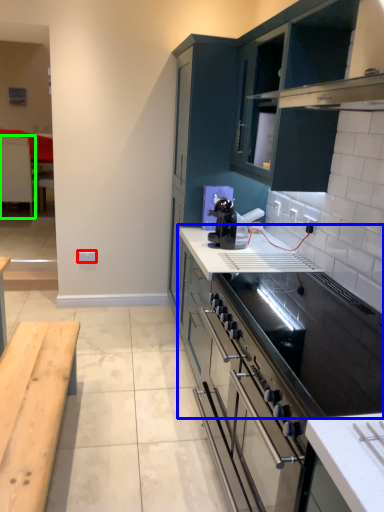
Question: Which object is positioned farthest from electric outlet (highlighted by a red box)? Select from countertop (highlighted by a blue box) and table (highlighted by a green box).

Choices:
 (A) countertop
 (B) table

Answer: (B)